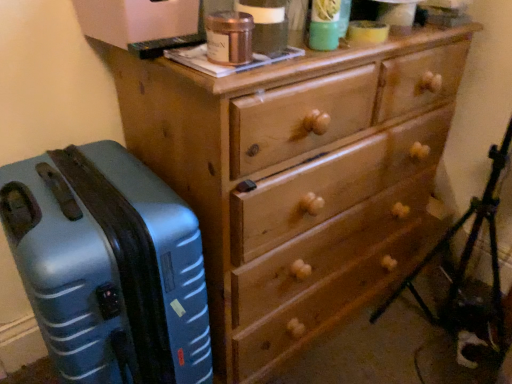
In order to click on wooden chest of drawers at center in this screenshot , I will do `click(297, 179)`.

The height and width of the screenshot is (384, 512). What do you see at coordinates (297, 179) in the screenshot?
I see `wooden chest of drawers at center` at bounding box center [297, 179].

What is the approximate height of wooden chest of drawers at center?

wooden chest of drawers at center is 33.51 inches in height.

The width and height of the screenshot is (512, 384). Describe the element at coordinates (109, 266) in the screenshot. I see `blue matte suitcase at left` at that location.

Where is `blue matte suitcase at left`? The width and height of the screenshot is (512, 384). blue matte suitcase at left is located at coordinates (109, 266).

Find the location of `wooden chest of drawers at center`. wooden chest of drawers at center is located at coordinates (297, 179).

In the scene shown: Which object is positioned more to the right, wooden chest of drawers at center or blue matte suitcase at left?

Positioned to the right is wooden chest of drawers at center.

Between wooden chest of drawers at center and blue matte suitcase at left, which one is positioned in front?

blue matte suitcase at left is more forward.

Is point (243, 162) positioned after point (201, 348)?

No, (243, 162) is in front of (201, 348).

From the image's perspective, relative to blue matte suitcase at left, is wooden chest of drawers at center above or below?

Based on their image positions, wooden chest of drawers at center is located above blue matte suitcase at left.

From a real-world perspective, is wooden chest of drawers at center physically located above or below blue matte suitcase at left?

wooden chest of drawers at center is above blue matte suitcase at left.

Considering the sizes of wooden chest of drawers at center and blue matte suitcase at left in the image, is wooden chest of drawers at center wider or thinner than blue matte suitcase at left?

In the image, wooden chest of drawers at center appears to be wider than blue matte suitcase at left.

From the picture: In terms of height, does wooden chest of drawers at center look taller or shorter compared to blue matte suitcase at left?

In the image, wooden chest of drawers at center appears to be taller than blue matte suitcase at left.

Looking at the image, does wooden chest of drawers at center seem bigger or smaller compared to blue matte suitcase at left?

Clearly, wooden chest of drawers at center is larger in size than blue matte suitcase at left.

Which is correct: wooden chest of drawers at center is inside blue matte suitcase at left, or outside of it?

wooden chest of drawers at center exists outside the volume of blue matte suitcase at left.

Would you consider wooden chest of drawers at center to be distant from blue matte suitcase at left?

No, wooden chest of drawers at center is not far from blue matte suitcase at left.

Is wooden chest of drawers at center aimed at blue matte suitcase at left?

No, wooden chest of drawers at center is not aimed at blue matte suitcase at left.

Where is `suitcase below the wooden chest of drawers at center (from the image's perspective)`? Image resolution: width=512 pixels, height=384 pixels. suitcase below the wooden chest of drawers at center (from the image's perspective) is located at coordinates (109, 266).

Considering the positions of objects blue matte suitcase at left and wooden chest of drawers at center in the image provided, who is more to the left, blue matte suitcase at left or wooden chest of drawers at center?

Positioned to the left is blue matte suitcase at left.

Which is in front, blue matte suitcase at left or wooden chest of drawers at center?

blue matte suitcase at left is closer to the camera.

Is point (122, 379) positioned in front of point (266, 291)?

Yes, point (122, 379) is in front of point (266, 291).

From the image's perspective, would you say blue matte suitcase at left is positioned over wooden chest of drawers at center?

Incorrect, from the image's perspective, blue matte suitcase at left is lower than wooden chest of drawers at center.

From a real-world perspective, between blue matte suitcase at left and wooden chest of drawers at center, who is vertically lower?

From a 3D spatial view, blue matte suitcase at left is below.

Considering the sizes of objects blue matte suitcase at left and wooden chest of drawers at center in the image provided, who is thinner, blue matte suitcase at left or wooden chest of drawers at center?

With smaller width is blue matte suitcase at left.

Between blue matte suitcase at left and wooden chest of drawers at center, which one has less height?

blue matte suitcase at left is shorter.

Considering the relative sizes of blue matte suitcase at left and wooden chest of drawers at center in the image provided, is blue matte suitcase at left bigger than wooden chest of drawers at center?

No, blue matte suitcase at left is not bigger than wooden chest of drawers at center.

Would you say wooden chest of drawers at center is part of blue matte suitcase at left's contents?

No, wooden chest of drawers at center is located outside of blue matte suitcase at left.

Is blue matte suitcase at left not close to wooden chest of drawers at center?

That's not correct — blue matte suitcase at left is a little close to wooden chest of drawers at center.

Is blue matte suitcase at left facing towards wooden chest of drawers at center?

No, blue matte suitcase at left is not facing towards wooden chest of drawers at center.

The width and height of the screenshot is (512, 384). In order to click on suitcase below the wooden chest of drawers at center (from a real-world perspective) in this screenshot , I will do `click(109, 266)`.

Locate an element on the screen. The width and height of the screenshot is (512, 384). suitcase lying below the wooden chest of drawers at center (from the image's perspective) is located at coordinates (109, 266).

Where is `chest of drawers that appears on the right of blue matte suitcase at left`? chest of drawers that appears on the right of blue matte suitcase at left is located at coordinates 297,179.